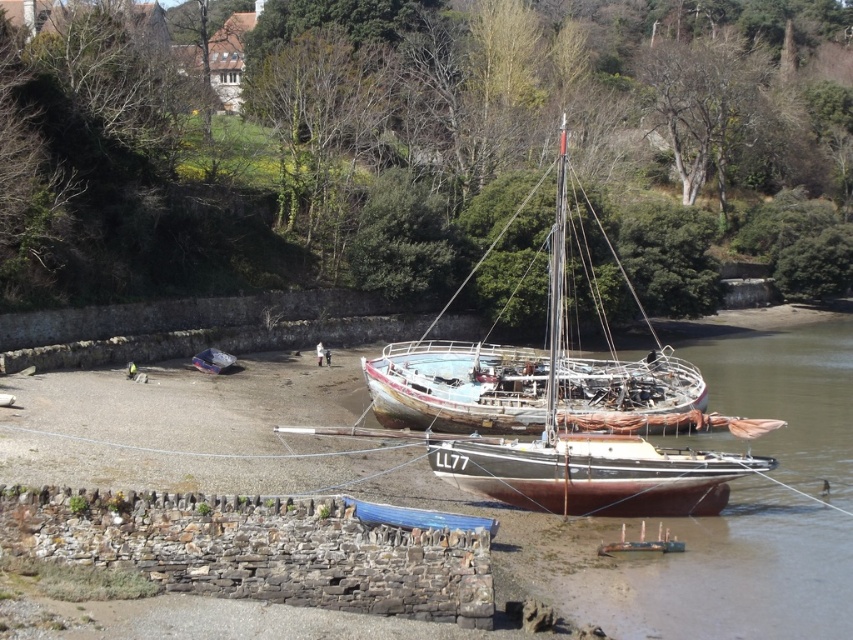
Does rusty metal sailboat at center have a greater height compared to rusty wooden boat at center?

Indeed, rusty metal sailboat at center has a greater height compared to rusty wooden boat at center.

Between rusty metal sailboat at center and rusty wooden boat at center, which one is positioned higher?

Positioned higher is rusty metal sailboat at center.

Which is in front, point (718, 499) or point (660, 401)?

Point (718, 499) is more forward.

Locate an element on the screen. The width and height of the screenshot is (853, 640). rusty metal sailboat at center is located at coordinates (x=585, y=442).